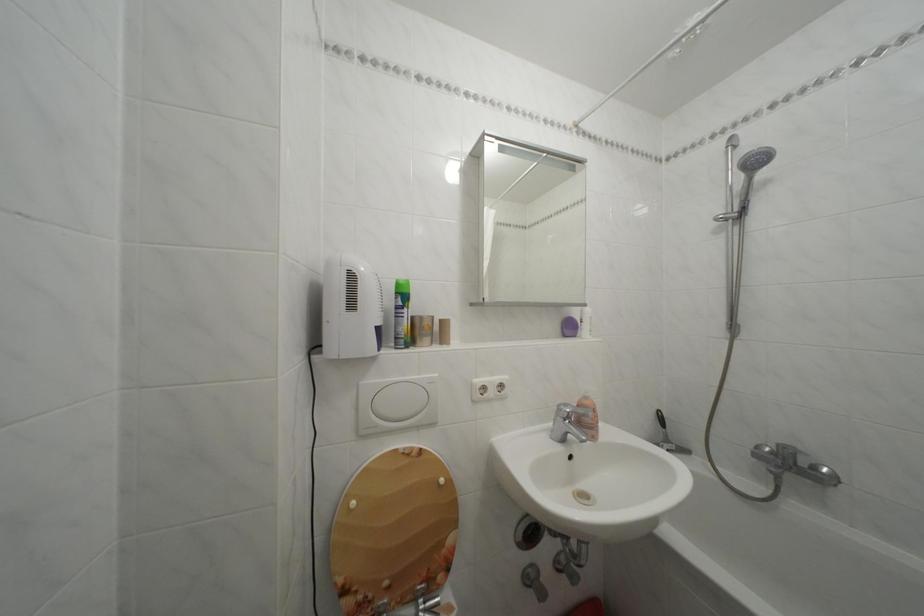
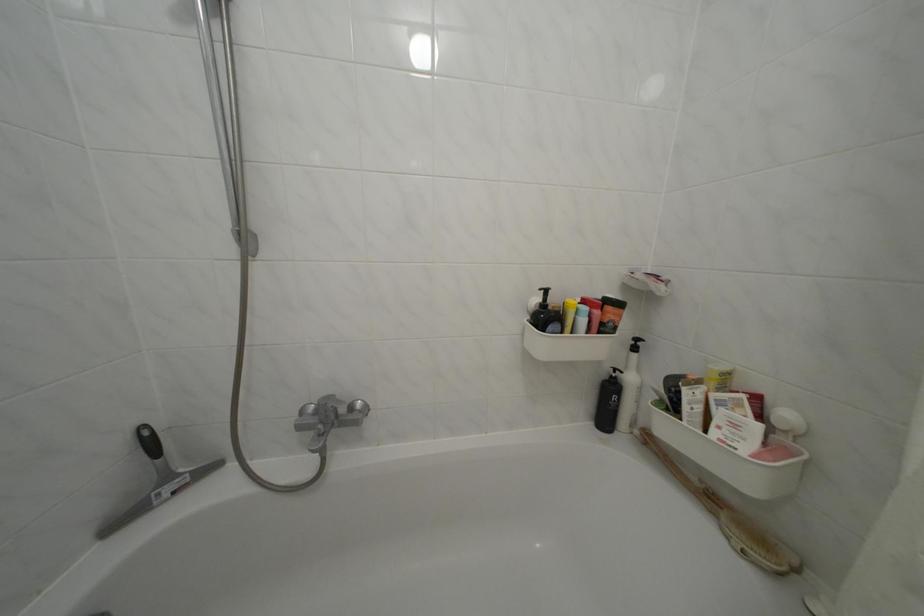
Locate, in the second image, the point that corresponds to point (780, 464) in the first image.

(323, 426)